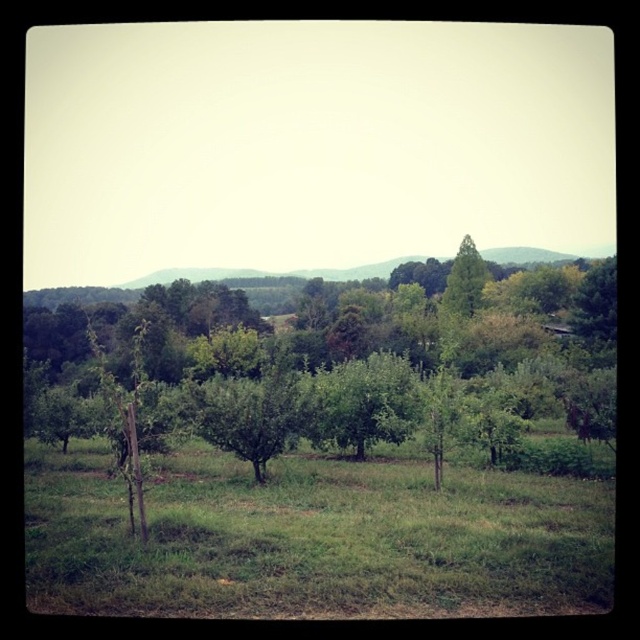
Question: From the image, what is the correct spatial relationship of green leafy tree at center in relation to green grass at center?

Choices:
 (A) right
 (B) left

Answer: (B)

Question: Which object appears closest to the camera in this image?

Choices:
 (A) green grass at center
 (B) green leafy tree at center

Answer: (A)

Question: In this image, where is green leafy tree at center located relative to green grass at center?

Choices:
 (A) left
 (B) right

Answer: (A)

Question: Can you confirm if green leafy tree at center is thinner than green grass at center?

Choices:
 (A) no
 (B) yes

Answer: (A)

Question: Among these objects, which one is nearest to the camera?

Choices:
 (A) green grass at center
 (B) green leafy tree at center

Answer: (A)